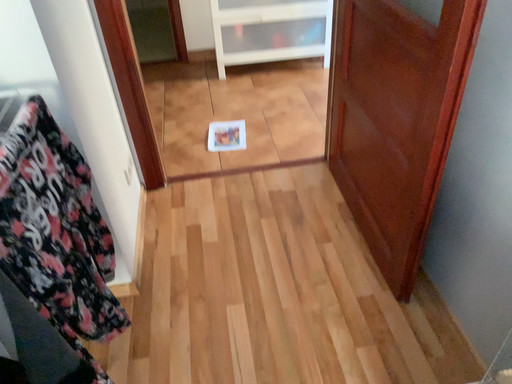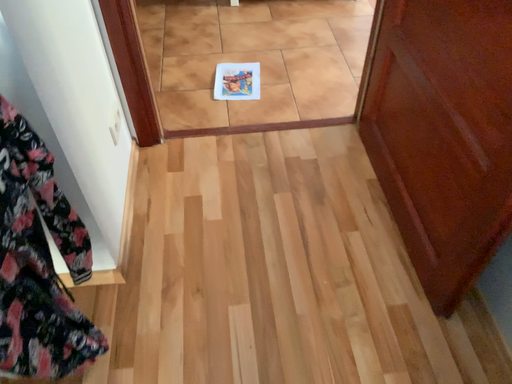
Question: How did the camera likely rotate when shooting the video?

Choices:
 (A) rotated upward
 (B) rotated downward

Answer: (B)